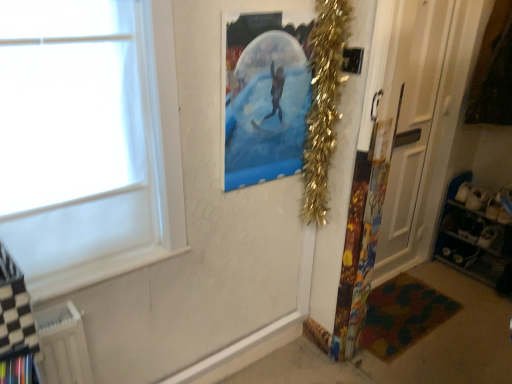
Where is `metallic blue shelves at lower right`? metallic blue shelves at lower right is located at coordinates (476, 235).

The height and width of the screenshot is (384, 512). What do you see at coordinates (476, 235) in the screenshot? I see `metallic blue shelves at lower right` at bounding box center [476, 235].

In order to face gold tinsel garland at upper right, should I rotate leftwards or rightwards?

You should rotate right by 8.861 degrees.

Measure the distance between transparent plastic poster at upper center and camera.

The distance of transparent plastic poster at upper center from camera is 1.32 meters.

Where is `white glossy door at right`? The height and width of the screenshot is (384, 512). white glossy door at right is located at coordinates (410, 117).

The width and height of the screenshot is (512, 384). Describe the element at coordinates (63, 345) in the screenshot. I see `white plastic radiator at lower left` at that location.

Identify the location of white plastic radiator at lower left. (63, 345).

Find the location of a particular element. This screenshot has width=512, height=384. metallic blue shelves at lower right is located at coordinates (476, 235).

Considering the sizes of objects transparent plastic poster at upper center and white plastic radiator at lower left in the image provided, who is taller, transparent plastic poster at upper center or white plastic radiator at lower left?

With more height is transparent plastic poster at upper center.

Can you see transparent plastic poster at upper center touching white plastic radiator at lower left?

There is a gap between transparent plastic poster at upper center and white plastic radiator at lower left.

Looking at this image, from the image's perspective, which object appears higher, transparent plastic poster at upper center or white plastic radiator at lower left?

From the image's view, transparent plastic poster at upper center is above.

Is transparent plastic poster at upper center wider than white plastic radiator at lower left?

In fact, transparent plastic poster at upper center might be narrower than white plastic radiator at lower left.

Who is bigger, white plastic radiator at lower left or multicolored fabric mat at lower right?

With larger size is white plastic radiator at lower left.

From the image's perspective, would you say white plastic radiator at lower left is shown under multicolored fabric mat at lower right?

No, from the image's perspective, white plastic radiator at lower left is not beneath multicolored fabric mat at lower right.

Visually, is white plastic radiator at lower left positioned to the left or to the right of multicolored fabric mat at lower right?

white plastic radiator at lower left is to the left of multicolored fabric mat at lower right.

Considering the positions of points (350, 1) and (403, 45), is point (350, 1) farther from camera compared to point (403, 45)?

That is False.

Image resolution: width=512 pixels, height=384 pixels. In order to click on christmas decoration located in front of the white glossy door at right in this screenshot , I will do `click(323, 103)`.

Considering the relative positions of gold tinsel garland at upper right and white glossy door at right in the image provided, is gold tinsel garland at upper right in front of white glossy door at right?

That is True.

Is there a large distance between gold tinsel garland at upper right and white glossy door at right?

No, gold tinsel garland at upper right is not far from white glossy door at right.

Could you tell me if white glossy door at right is turned towards metallic blue shelves at lower right?

No.

Considering their positions, is white glossy door at right located in front of or behind metallic blue shelves at lower right?

white glossy door at right is in front of metallic blue shelves at lower right.

Is white glossy door at right next to metallic blue shelves at lower right and touching it?

No, white glossy door at right is not making contact with metallic blue shelves at lower right.

Is metallic blue shelves at lower right surrounded by white glossy door at right?

No.

Based on their positions, is white glossy door at right located to the left or right of white plastic radiator at lower left?

Clearly, white glossy door at right is on the right of white plastic radiator at lower left in the image.

Which object is thinner, white glossy door at right or white plastic radiator at lower left?

white glossy door at right is thinner.

What's the angular difference between white glossy door at right and white plastic radiator at lower left's facing directions?

The facing directions of white glossy door at right and white plastic radiator at lower left are 0.791 degrees apart.

Does white glossy door at right have a greater height compared to white plastic radiator at lower left?

Indeed, white glossy door at right has a greater height compared to white plastic radiator at lower left.

Based on the photo, is white glossy door at right aimed at gold tinsel garland at upper right?

No, white glossy door at right is not turned towards gold tinsel garland at upper right.

Measure the distance from white glossy door at right to gold tinsel garland at upper right.

The distance of white glossy door at right from gold tinsel garland at upper right is 31.55 inches.

Is there a large distance between white glossy door at right and gold tinsel garland at upper right?

No, white glossy door at right is not far from gold tinsel garland at upper right.

Is white plastic radiator at lower left aimed at white glossy door at right?

No, white plastic radiator at lower left is not facing towards white glossy door at right.

From the image's perspective, is white plastic radiator at lower left located above or below white glossy door at right?

From the image's perspective, white plastic radiator at lower left appears below white glossy door at right.

Consider the image. Is white plastic radiator at lower left surrounding white glossy door at right?

No, white glossy door at right is not surrounded by white plastic radiator at lower left.

Is white plastic radiator at lower left further to the viewer compared to white glossy door at right?

No, it is not.

Find the location of a particular element. This screenshot has height=384, width=512. picture frame above the white plastic radiator at lower left (from the image's perspective) is located at coordinates (266, 96).

In the image, there is a white plastic radiator at lower left. Where is `mat below it (from the image's perspective)`? This screenshot has height=384, width=512. mat below it (from the image's perspective) is located at coordinates (403, 315).

Looking at the image, which one is located further to white glossy door at right, white plastic radiator at lower left or metallic blue shelves at lower right?

Among the two, white plastic radiator at lower left is located further to white glossy door at right.

Considering their positions, is white plastic radiator at lower left positioned closer to gold tinsel garland at upper right than white glossy door at right?

white glossy door at right is closer to gold tinsel garland at upper right.

Based on their spatial positions, is white glossy door at right or gold tinsel garland at upper right closer to multicolored fabric mat at lower right?

white glossy door at right lies closer to multicolored fabric mat at lower right than the other object.

Based on their spatial positions, is transparent plastic poster at upper center or white glossy door at right closer to metallic blue shelves at lower right?

white glossy door at right.

Based on their spatial positions, is white plastic radiator at lower left or white glossy door at right closer to transparent plastic poster at upper center?

white plastic radiator at lower left.

From the image, which object appears to be farther from gold tinsel garland at upper right, white glossy door at right or white plastic radiator at lower left?

white plastic radiator at lower left is positioned further to the anchor gold tinsel garland at upper right.

Based on their spatial positions, is metallic blue shelves at lower right or multicolored fabric mat at lower right closer to transparent plastic poster at upper center?

multicolored fabric mat at lower right.

Looking at the image, which one is located closer to multicolored fabric mat at lower right, white plastic radiator at lower left or metallic blue shelves at lower right?

Among the two, metallic blue shelves at lower right is located nearer to multicolored fabric mat at lower right.

Image resolution: width=512 pixels, height=384 pixels. Identify the location of christmas decoration located between white plastic radiator at lower left and metallic blue shelves at lower right in the left-right direction. (323, 103).

Find the location of a particular element. christmas decoration between transparent plastic poster at upper center and white glossy door at right from left to right is located at coordinates (323, 103).

Identify the location of christmas decoration between transparent plastic poster at upper center and multicolored fabric mat at lower right vertically. (323, 103).

Image resolution: width=512 pixels, height=384 pixels. I want to click on door between white plastic radiator at lower left and metallic blue shelves at lower right, so pyautogui.click(x=410, y=117).